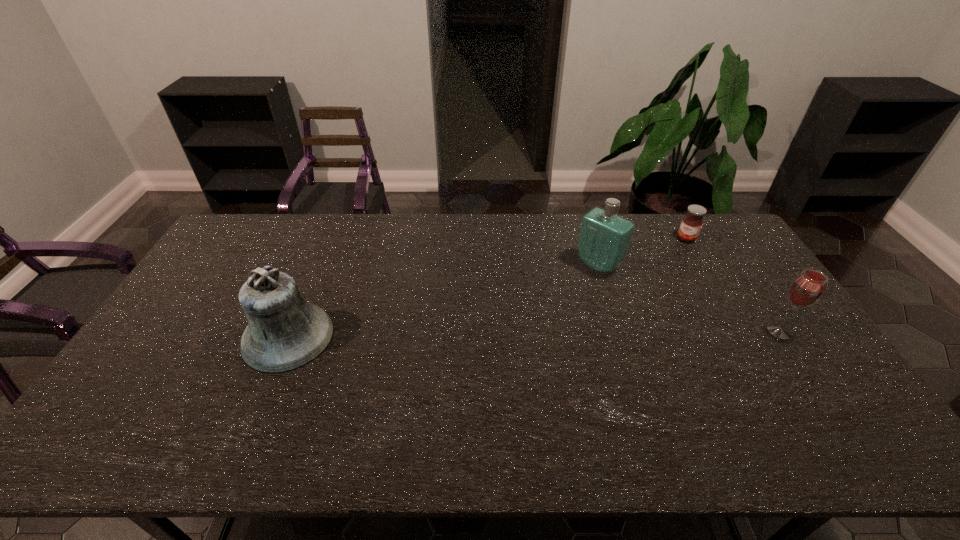
Where is `free point between the bell and the second object from left to right`? free point between the bell and the second object from left to right is located at coordinates (444, 301).

Where is `free space between the perfume and the third tallest object`? free space between the perfume and the third tallest object is located at coordinates (689, 298).

At what (x,y) coordinates should I click in order to perform the action: click on vacant area between the second shortest object and the shortest object. Please return your answer as a coordinate pair (x, y). The width and height of the screenshot is (960, 540). Looking at the image, I should click on (732, 285).

I want to click on empty space that is in between the leftmost object and the rightmost object, so click(534, 334).

At what (x,y) coordinates should I click in order to perform the action: click on free space between the second shortest object and the leftmost object. Please return your answer as a coordinate pair (x, y). Looking at the image, I should click on (534, 334).

Where is `free space between the second farthest object and the leftmost object`? Image resolution: width=960 pixels, height=540 pixels. free space between the second farthest object and the leftmost object is located at coordinates (444, 301).

Identify which object is the third closest to the leftmost object. Please provide its 2D coordinates. Your answer should be formatted as a tuple, i.e. [(x, y)], where the tuple contains the x and y coordinates of a point satisfying the conditions above.

[(806, 289)]

Where is `the closest object to the leftmost object`? Image resolution: width=960 pixels, height=540 pixels. the closest object to the leftmost object is located at coordinates (604, 239).

Find the location of a particular element. The image size is (960, 540). vacant position in the image that satisfies the following two spatial constraints: 1. on the back side of the perfume; 2. on the right side of the jam is located at coordinates (590, 239).